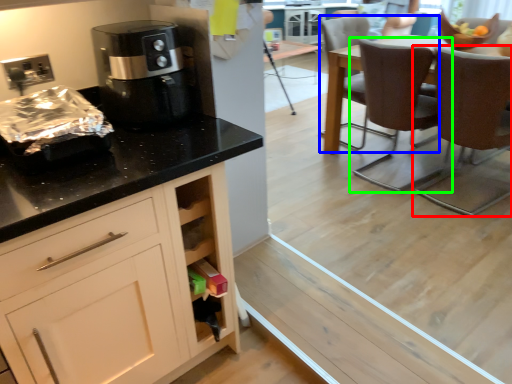
Question: Which object is positioned farthest from chair (highlighted by a red box)? Select from chair (highlighted by a blue box) and chair (highlighted by a green box).

Choices:
 (A) chair
 (B) chair

Answer: (A)